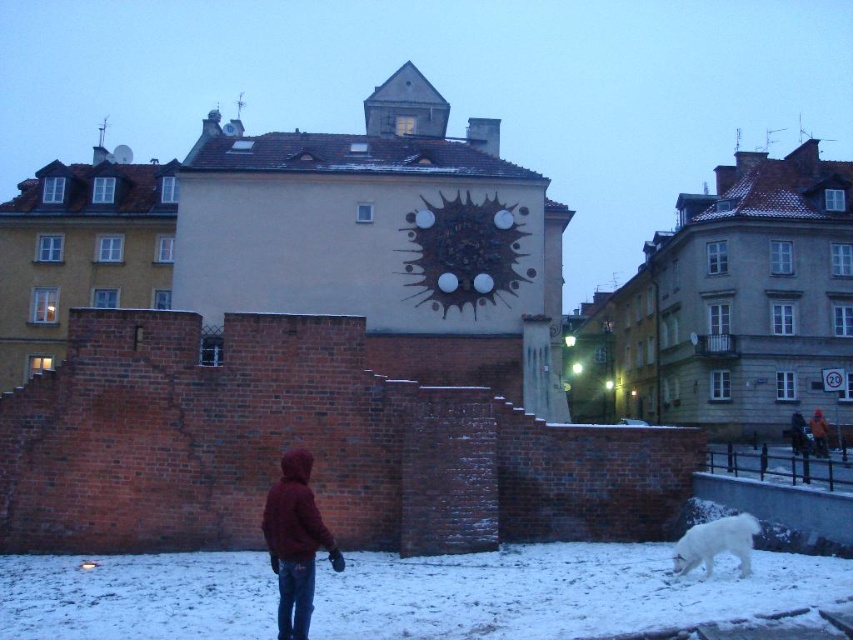
Question: Estimate the real-world distances between objects in this image. Which object is farther from the maroon hoodie at center?

Choices:
 (A) red woolen jacket at center
 (B) white powdery snow at lower center

Answer: (A)

Question: Can you confirm if maroon hoodie at center is thinner than white fluffy dog at lower right?

Choices:
 (A) yes
 (B) no

Answer: (B)

Question: Is white fluffy dog at lower right thinner than red woolen jacket at center?

Choices:
 (A) no
 (B) yes

Answer: (B)

Question: Can you confirm if maroon hoodie at center is wider than white fluffy dog at lower right?

Choices:
 (A) no
 (B) yes

Answer: (B)

Question: Which point is closer to the camera?

Choices:
 (A) maroon hoodie at center
 (B) white fluffy dog at lower right

Answer: (A)

Question: Which object is positioned closest to the white powdery snow at lower center?

Choices:
 (A) red woolen jacket at center
 (B) maroon hoodie at center
 (C) white fluffy dog at lower right

Answer: (B)